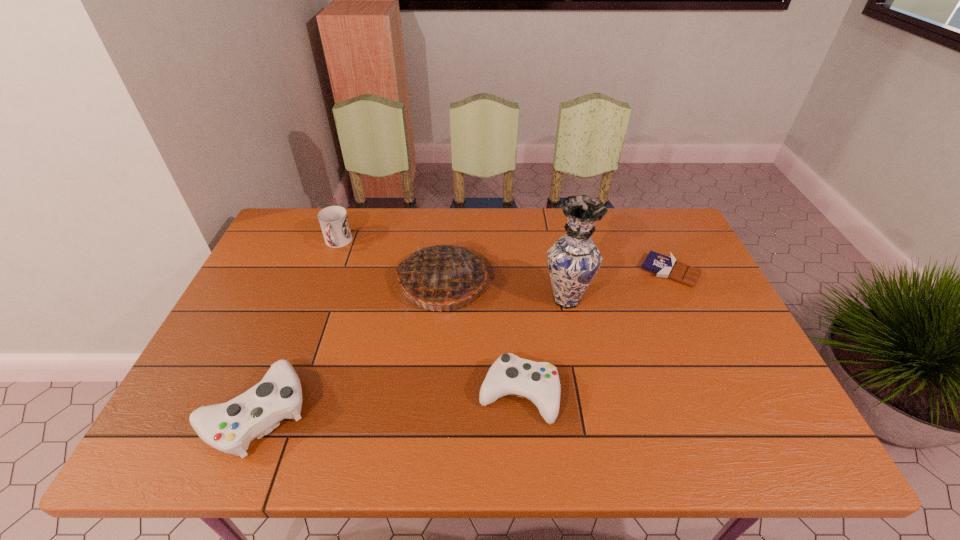
In the image, there is a desktop. What are the coordinates of `free space at the near edge` in the screenshot? It's located at (580, 403).

In the image, there is a desktop. At what (x,y) coordinates should I click in order to perform the action: click on free space at the left edge. Please return your answer as a coordinate pair (x, y). Image resolution: width=960 pixels, height=540 pixels. Looking at the image, I should click on (247, 285).

In order to click on vacant space at the far left corner in this screenshot , I will do `click(312, 219)`.

The width and height of the screenshot is (960, 540). I want to click on vacant area at the far right corner of the desktop, so click(x=652, y=210).

Locate an element on the screen. vacant space in between the pie and the tallest object is located at coordinates (504, 291).

At what (x,y) coordinates should I click in order to perform the action: click on empty space that is in between the taller control and the pie. Please return your answer as a coordinate pair (x, y). Looking at the image, I should click on (348, 347).

I want to click on blank region between the right control and the chocolate bar, so click(x=594, y=333).

Locate an element on the screen. vacant point located between the rightmost object and the cup is located at coordinates (504, 257).

Image resolution: width=960 pixels, height=540 pixels. Identify the location of free space between the fifth tallest object and the shortest object. (594, 333).

Where is `free space between the shorter control and the taller control`? free space between the shorter control and the taller control is located at coordinates (387, 403).